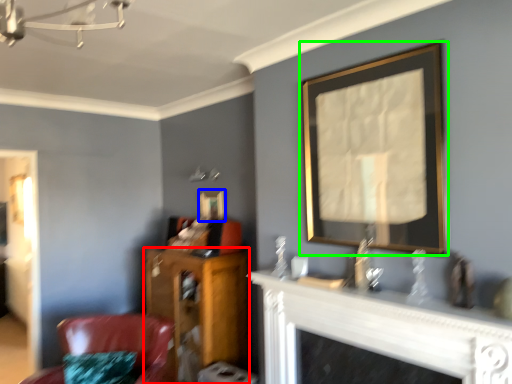
Question: Estimate the real-world distances between objects in this image. Which object is closer to furniture (highlighted by a red box), picture frame (highlighted by a blue box) or picture frame (highlighted by a green box)?

Choices:
 (A) picture frame
 (B) picture frame

Answer: (A)